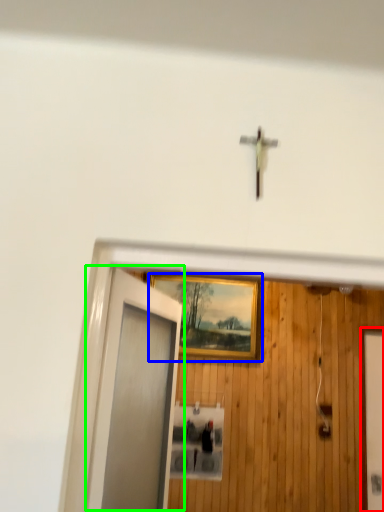
Question: Based on their relative distances, which object is nearer to elevator door (highlighted by a red box)? Choose from picture frame (highlighted by a blue box) and door (highlighted by a green box).

Choices:
 (A) picture frame
 (B) door

Answer: (A)